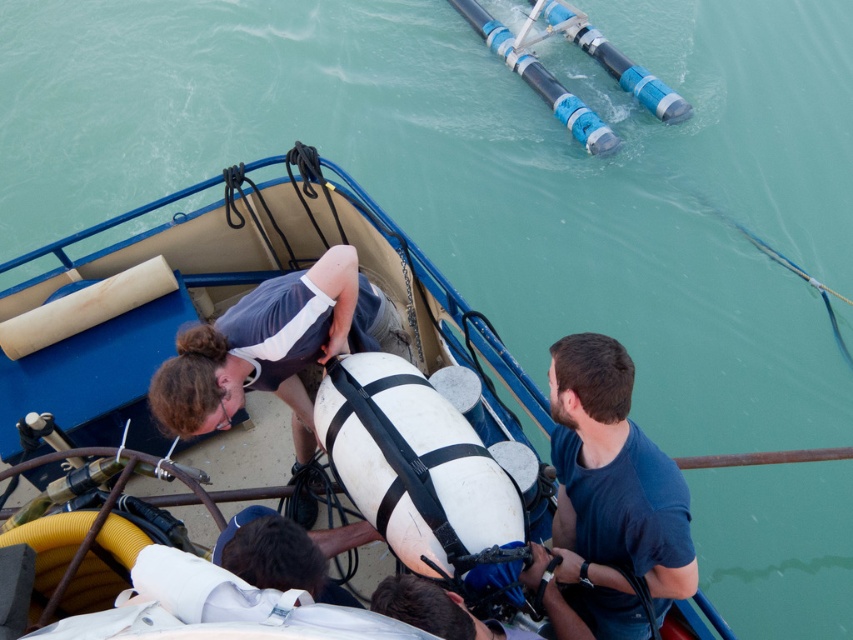
Can you confirm if dark blue t-shirt at center is wider than matte gray wetsuit at center?

Incorrect, dark blue t-shirt at center's width does not surpass matte gray wetsuit at center's.

Can you confirm if dark blue t-shirt at center is shorter than matte gray wetsuit at center?

Incorrect, dark blue t-shirt at center's height does not fall short of matte gray wetsuit at center's.

Locate an element on the screen. dark blue t-shirt at center is located at coordinates (613, 493).